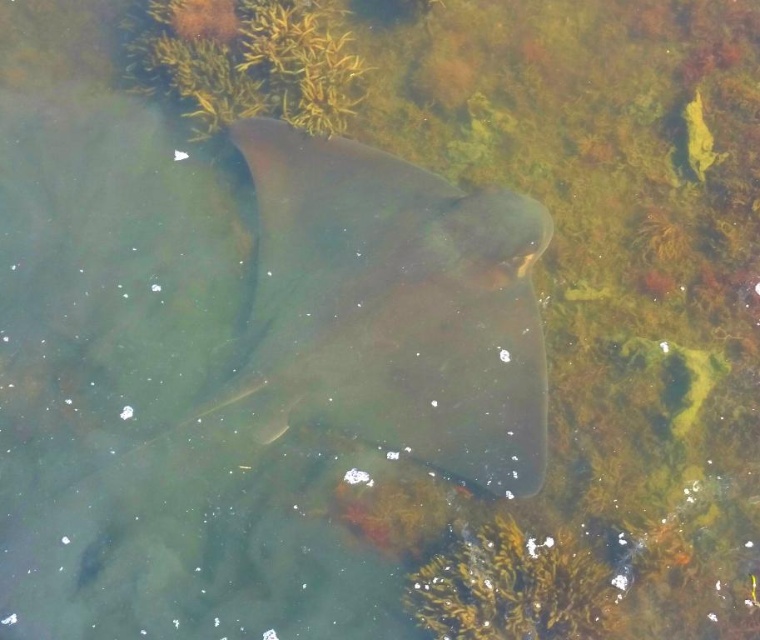
Question: Does smooth gray stingray at center appear on the right side of yellow-green fibrous algae at upper center?

Choices:
 (A) yes
 (B) no

Answer: (A)

Question: Which object is positioned farthest from the yellow-green fibrous algae at upper center?

Choices:
 (A) smooth gray stingray at center
 (B) green matte algae at lower center

Answer: (B)

Question: Considering the real-world distances, which object is farthest from the smooth gray stingray at center?

Choices:
 (A) yellow-green fibrous algae at upper center
 (B) green matte algae at lower center

Answer: (B)

Question: Which of these objects is positioned closest to the yellow-green fibrous algae at upper center?

Choices:
 (A) smooth gray stingray at center
 (B) green matte algae at lower center

Answer: (A)

Question: Is smooth gray stingray at center smaller than green matte algae at lower center?

Choices:
 (A) yes
 (B) no

Answer: (B)

Question: Is smooth gray stingray at center wider than green matte algae at lower center?

Choices:
 (A) yes
 (B) no

Answer: (A)